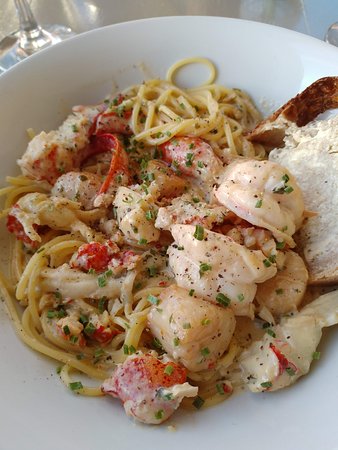
At what (x,y) coordinates should I click in order to perform the action: click on plate. Please return your answer as a coordinate pair (x, y). Looking at the image, I should click on (70, 76).